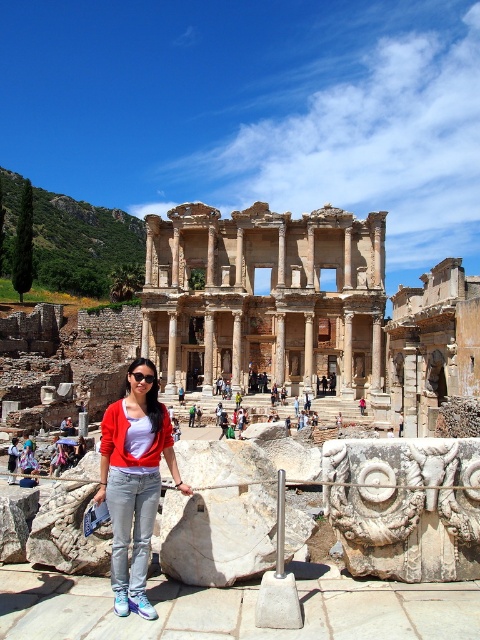
Is brown stone ruins at center thinner than denim jacket at center?

No.

Between brown stone ruins at center and denim jacket at center, which one has more height?

brown stone ruins at center is taller.

Who is more distant from viewer, (262, 211) or (126, 486)?

The point (262, 211) is behind.

The height and width of the screenshot is (640, 480). I want to click on brown stone ruins at center, so click(x=264, y=298).